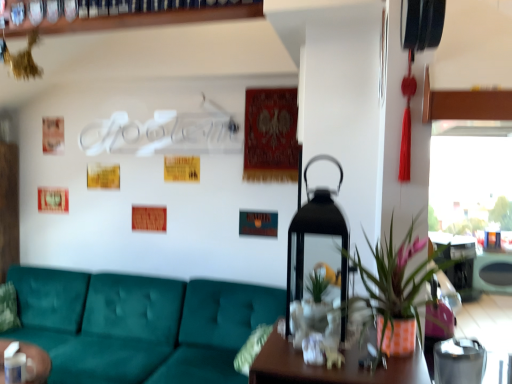
Question: Considering the relative positions of teal fabric couch at lower left and orange textured pot at center in the image provided, is teal fabric couch at lower left to the right of orange textured pot at center from the viewer's perspective?

Choices:
 (A) no
 (B) yes

Answer: (A)

Question: Is teal fabric couch at lower left bigger than orange textured pot at center?

Choices:
 (A) yes
 (B) no

Answer: (A)

Question: Is teal fabric couch at lower left further to camera compared to orange textured pot at center?

Choices:
 (A) no
 (B) yes

Answer: (B)

Question: Can you confirm if teal fabric couch at lower left is positioned to the left of orange textured pot at center?

Choices:
 (A) no
 (B) yes

Answer: (B)

Question: Can you confirm if teal fabric couch at lower left is taller than orange textured pot at center?

Choices:
 (A) no
 (B) yes

Answer: (B)

Question: Is teal fabric couch at lower left closer to the viewer compared to orange textured pot at center?

Choices:
 (A) yes
 (B) no

Answer: (B)

Question: Is teal fabric couch at lower left located within transparent glass window at upper right?

Choices:
 (A) yes
 (B) no

Answer: (B)

Question: Could you tell me if transparent glass window at upper right is turned towards teal fabric couch at lower left?

Choices:
 (A) yes
 (B) no

Answer: (B)

Question: Would you say transparent glass window at upper right is outside teal fabric couch at lower left?

Choices:
 (A) no
 (B) yes

Answer: (B)

Question: From a real-world perspective, is transparent glass window at upper right located higher than teal fabric couch at lower left?

Choices:
 (A) no
 (B) yes

Answer: (B)

Question: Are transparent glass window at upper right and teal fabric couch at lower left beside each other?

Choices:
 (A) yes
 (B) no

Answer: (B)

Question: Can you confirm if transparent glass window at upper right is taller than teal fabric couch at lower left?

Choices:
 (A) no
 (B) yes

Answer: (A)

Question: Is transparent glass window at upper right facing towards orange textured pot at center?

Choices:
 (A) yes
 (B) no

Answer: (A)